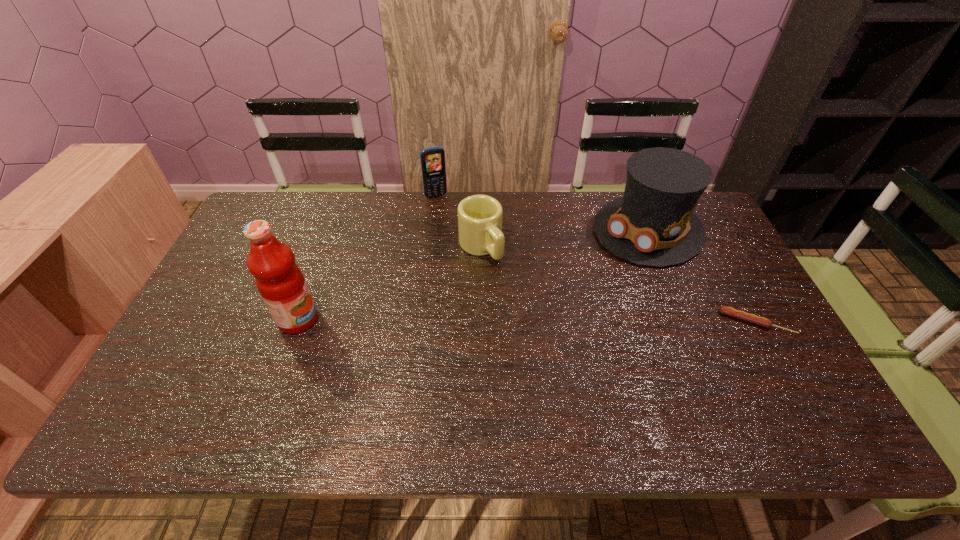
Find the location of a particular element. The width and height of the screenshot is (960, 540). mug that is positioned at the far edge is located at coordinates (480, 233).

This screenshot has width=960, height=540. I want to click on cellular telephone at the far edge, so click(432, 159).

I want to click on sausage situated at the right edge, so click(x=729, y=311).

The width and height of the screenshot is (960, 540). What are the coordinates of `dress hat at the right edge` in the screenshot? It's located at (653, 224).

I want to click on object that is positioned at the far right corner, so coord(653,224).

This screenshot has height=540, width=960. I want to click on vacant area at the far edge, so (341, 221).

In the image, there is a desktop. At what (x,y) coordinates should I click in order to perform the action: click on vacant space at the near edge. Please return your answer as a coordinate pair (x, y). The image size is (960, 540). Looking at the image, I should click on (705, 374).

Locate an element on the screen. This screenshot has height=540, width=960. vacant position at the right edge of the desktop is located at coordinates (732, 321).

Identify the location of vacant space at the far left corner of the desktop. (270, 201).

The image size is (960, 540). Find the location of `vacant space at the near left corner`. vacant space at the near left corner is located at coordinates (205, 366).